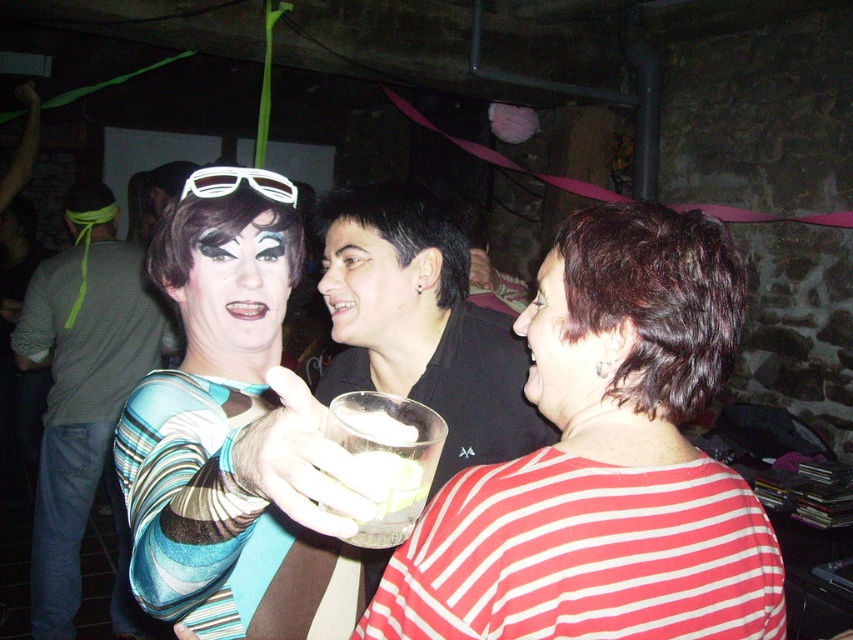
Question: Which point is closer to the camera?

Choices:
 (A) white plastic goggles at upper center
 (B) clear glass at center
 (C) striped jersey at center
 (D) matte black face at center

Answer: (C)

Question: Is clear glass at center to the right of white plastic goggles at upper center from the viewer's perspective?

Choices:
 (A) yes
 (B) no

Answer: (A)

Question: Does matte black face at center have a greater width compared to white plastic goggles at upper center?

Choices:
 (A) yes
 (B) no

Answer: (A)

Question: Which object appears farthest from the camera in this image?

Choices:
 (A) smooth skin face at center
 (B) white plastic goggles at upper center
 (C) striped fabric shirt at left
 (D) matte black face at center

Answer: (C)

Question: Is matte black face at center to the left of smooth skin face at center from the viewer's perspective?

Choices:
 (A) no
 (B) yes

Answer: (B)

Question: Which object appears closest to the camera in this image?

Choices:
 (A) striped jersey at center
 (B) smooth skin face at center
 (C) white plastic goggles at upper center

Answer: (A)